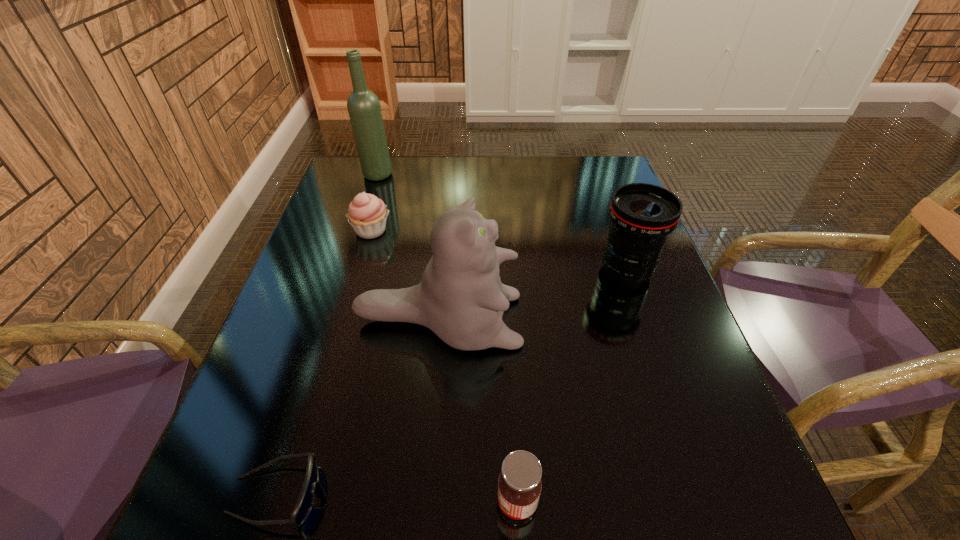
I want to click on cupcake at the left edge, so tap(367, 214).

Locate an element on the screen. The image size is (960, 540). sunglasses that is at the left edge is located at coordinates (306, 498).

This screenshot has width=960, height=540. In order to click on object located at the right edge in this screenshot , I will do `click(642, 215)`.

Find the location of a particular element. This screenshot has width=960, height=540. object located in the far left corner section of the desktop is located at coordinates click(x=364, y=109).

Find the location of a particular element. This screenshot has height=540, width=960. object positioned at the near left corner is located at coordinates (306, 498).

This screenshot has height=540, width=960. In order to click on free location at the far edge in this screenshot , I will do `click(473, 188)`.

Where is `free location at the near edge`? The height and width of the screenshot is (540, 960). free location at the near edge is located at coordinates (653, 504).

Identify the location of vacant space at the left edge of the desktop. This screenshot has width=960, height=540. (306, 373).

Locate an element on the screen. The image size is (960, 540). blank space at the right edge of the desktop is located at coordinates (594, 206).

Locate an element on the screen. The height and width of the screenshot is (540, 960). free space at the far left corner is located at coordinates (354, 174).